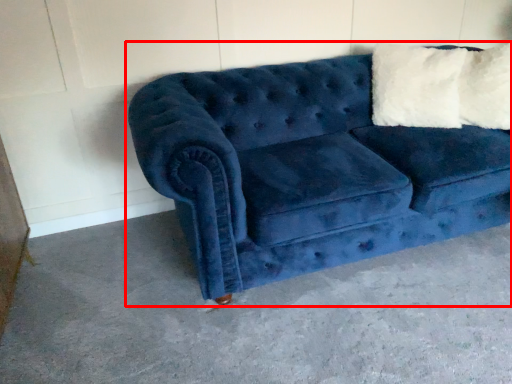
Question: From the image's perspective, what is the correct spatial relationship of studio couch (annotated by the red box) in relation to concrete?

Choices:
 (A) below
 (B) above

Answer: (B)